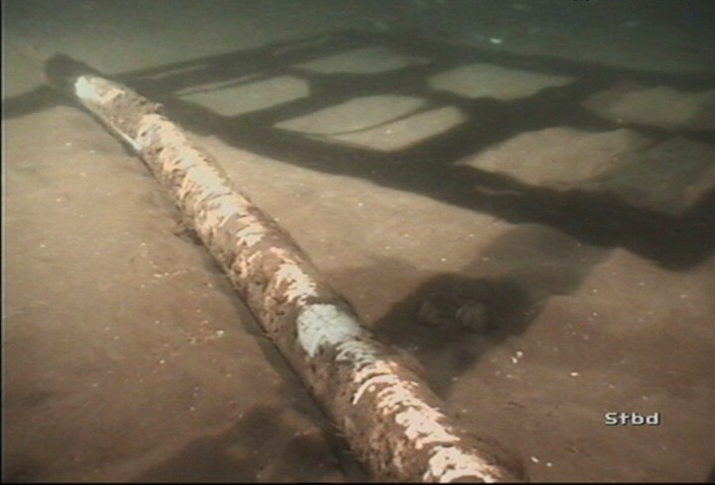
Locate an element on the screen. This screenshot has height=485, width=715. shadow from beam is located at coordinates (506, 273), (287, 435), (31, 102).